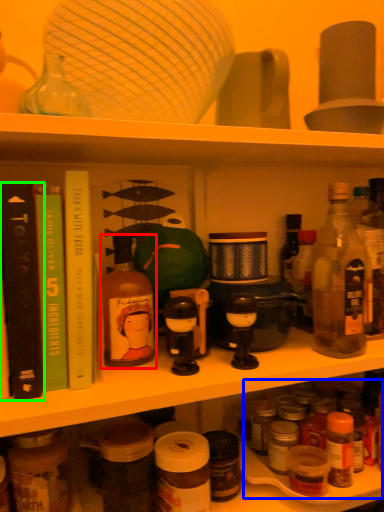
Question: Which is farther away from bottle (highlighted by a red box)? drink (highlighted by a blue box) or book (highlighted by a green box)?

Choices:
 (A) drink
 (B) book

Answer: (A)